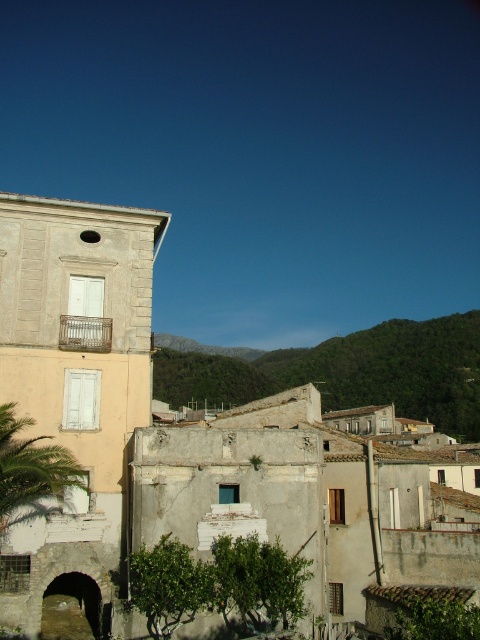
You are standing in the town square and see the light beige stone building at left and the green leafy palm tree at lower left. Which object is closer to the left edge of the image?

A: The green leafy palm tree at lower left is closer to the left edge of the image because the light beige stone building at left is positioned to its right side.

You are standing at the center of the town square and see the point at coordinates (193, 442). Which building does this point indicate?

The point at coordinates (193, 442) corresponds to the light beige stone building at left.

You are standing in the town square and want to take a photo of the light beige stone building at left and the green leafy hillside at center. Which object should you frame first in your camera viewfinder to ensure both are captured in the same shot?

You should frame the light beige stone building at left first since it is positioned on the left side of the green leafy hillside at center, allowing both to be included in the same shot when starting from the left.